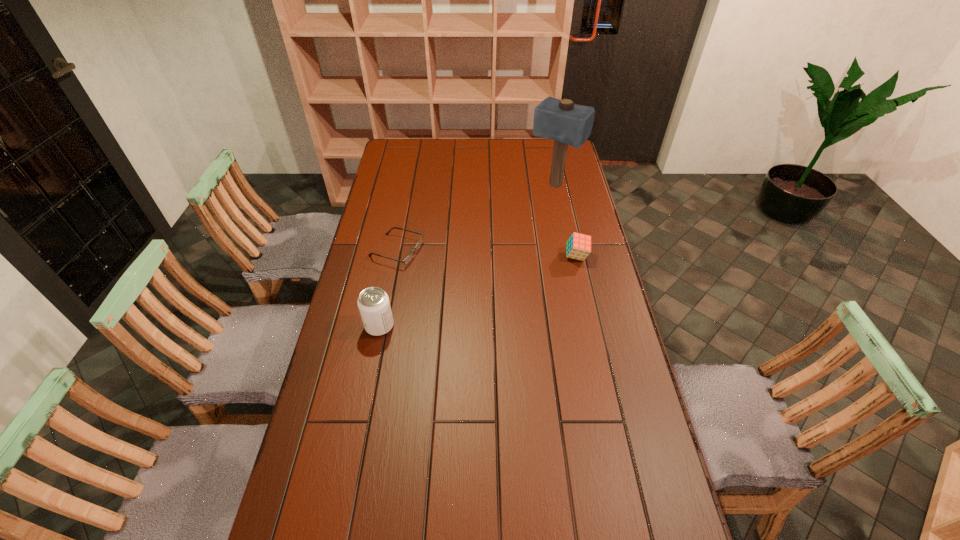
Find the location of a particular element. The height and width of the screenshot is (540, 960). soda can is located at coordinates (373, 303).

Where is `the second tallest object`? The image size is (960, 540). the second tallest object is located at coordinates (373, 303).

I want to click on cube, so click(578, 247).

Locate an element on the screen. This screenshot has width=960, height=540. the shortest object is located at coordinates (410, 256).

What are the coordinates of `the farthest object` in the screenshot? It's located at (566, 123).

Identify the location of the tallest object. The image size is (960, 540). (566, 123).

At what (x,y) coordinates should I click in order to perform the action: click on free space located on the front of the second tallest object. Please return your answer as a coordinate pair (x, y). The width and height of the screenshot is (960, 540). Looking at the image, I should click on (352, 465).

Identify the location of free location located 0.080m on the front of the cube. This screenshot has height=540, width=960. (582, 280).

Find the location of a particular element. The image size is (960, 540). free space located on the front-facing side of the shortest object is located at coordinates (440, 262).

Find the location of a particular element. Image resolution: width=960 pixels, height=540 pixels. free space located on the front-facing side of the shortest object is located at coordinates (435, 261).